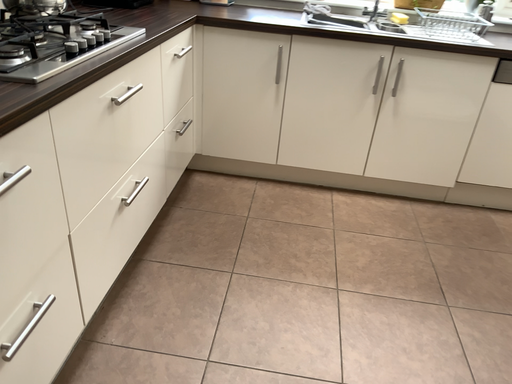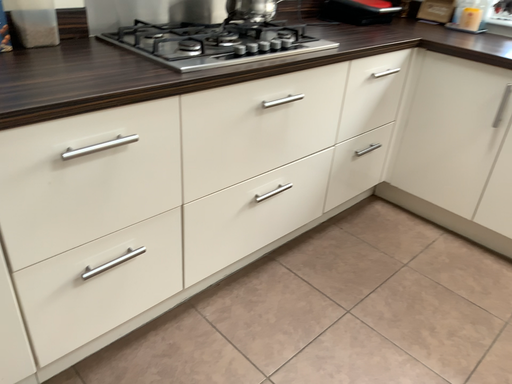
Question: How did the camera likely rotate when shooting the video?

Choices:
 (A) rotated downward
 (B) rotated upward

Answer: (B)